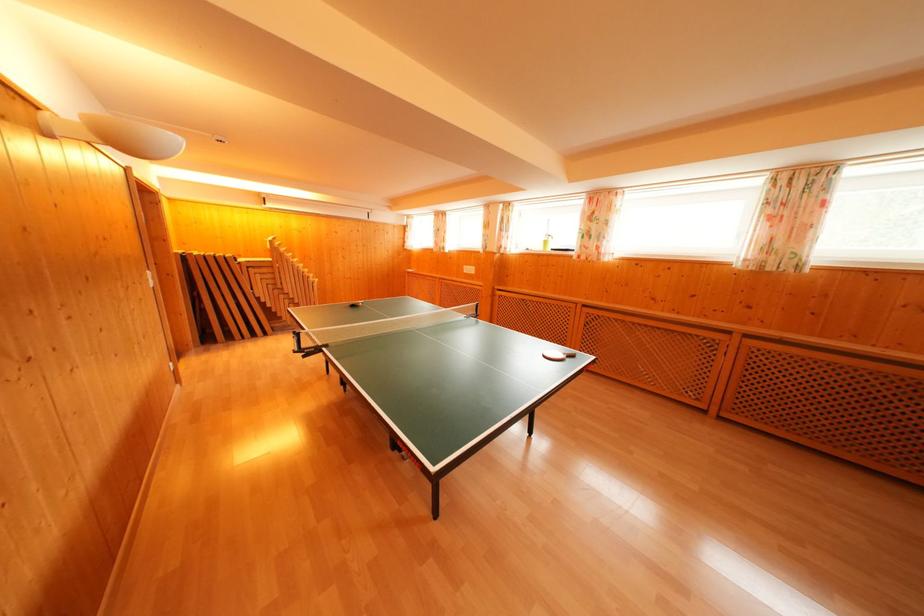
The location [553,355] corresponds to which object?

This point indicates the white ping pong paddle.